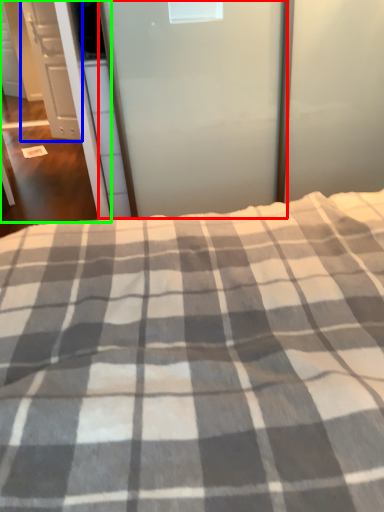
Question: Which object is positioned farthest from screen door (highlighted by a red box)? Select from cabinetry (highlighted by a blue box) and screen door (highlighted by a green box).

Choices:
 (A) cabinetry
 (B) screen door

Answer: (A)